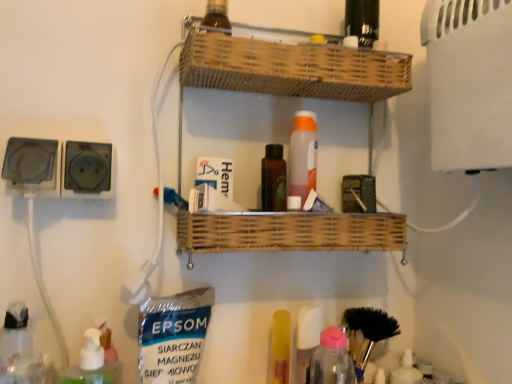
Question: Should I look upward or downward to see woven wood shelf at center?

Choices:
 (A) up
 (B) down

Answer: (A)

Question: Is yellow plastic tube at lower center positioned with its back to brown glass bottle at upper center?

Choices:
 (A) yes
 (B) no

Answer: (B)

Question: Is the surface of yellow plastic tube at lower center in direct contact with brown glass bottle at upper center?

Choices:
 (A) yes
 (B) no

Answer: (B)

Question: Considering the relative sizes of yellow plastic tube at lower center and brown glass bottle at upper center in the image provided, is yellow plastic tube at lower center shorter than brown glass bottle at upper center?

Choices:
 (A) no
 (B) yes

Answer: (A)

Question: Is yellow plastic tube at lower center thinner than brown glass bottle at upper center?

Choices:
 (A) no
 (B) yes

Answer: (A)

Question: Is yellow plastic tube at lower center completely or partially outside of brown glass bottle at upper center?

Choices:
 (A) no
 (B) yes

Answer: (B)

Question: Does yellow plastic tube at lower center have a greater height compared to brown glass bottle at upper center?

Choices:
 (A) no
 (B) yes

Answer: (B)

Question: Can we say woven wood shelf at center lies outside black plastic socket at left, acting as the 1th electric outlet starting from the left?

Choices:
 (A) no
 (B) yes

Answer: (B)

Question: Does woven wood shelf at center have a lesser width compared to black plastic socket at left, acting as the 1th electric outlet starting from the left?

Choices:
 (A) no
 (B) yes

Answer: (A)

Question: From the image's perspective, does woven wood shelf at center appear lower than black plastic socket at left, acting as the 1th electric outlet starting from the left?

Choices:
 (A) yes
 (B) no

Answer: (B)

Question: Considering the relative positions of woven wood shelf at center and black plastic socket at left, acting as the 1th electric outlet starting from the left, in the image provided, is woven wood shelf at center to the left of black plastic socket at left, acting as the 1th electric outlet starting from the left, from the viewer's perspective?

Choices:
 (A) yes
 (B) no

Answer: (B)

Question: Considering the relative sizes of woven wood shelf at center and black plastic socket at left, acting as the 1th electric outlet starting from the left, in the image provided, is woven wood shelf at center shorter than black plastic socket at left, acting as the 1th electric outlet starting from the left,?

Choices:
 (A) yes
 (B) no

Answer: (B)

Question: From a real-world perspective, does woven wood shelf at center sit lower than black plastic socket at left, positioned as the 2th electric outlet in right-to-left order?

Choices:
 (A) yes
 (B) no

Answer: (B)

Question: Is brown glass bottle at upper center positioned before black plastic socket at left, positioned as the 2th electric outlet in right-to-left order?

Choices:
 (A) no
 (B) yes

Answer: (A)